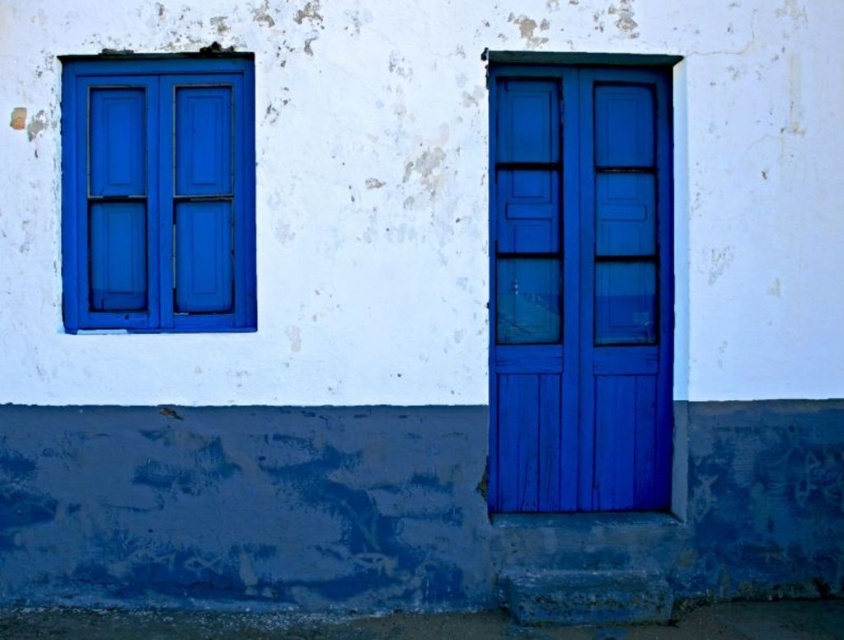
You are a delivery person standing at the entrance of the building. You need to locate the matte wood door at right. Based on the coordinates provided, where should you look to find it?

The matte wood door at right is located at coordinates point 0.442 on the x axis and 0.687 on the y axis.

From the picture: You are a painter standing on a ladder that can reach up to 2 meters. You need to paint the matte wood door at right and the matte blue window at upper left. Can you reach both without moving the ladder?

The distance between the matte wood door at right and the matte blue window at upper left is 1.51 meters. Since the ladder can reach up to 2 meters, you can reach both without moving the ladder as the distance is within the ladder height limit.

You are standing 10 meters away from the building exterior. There is a point marked at coordinates point (547, 504). Can you estimate whether this point is closer to you or farther than your current position?

The point (547, 504) is located 7.07 meters away from the viewer, which is closer than your current position of 10 meters away.